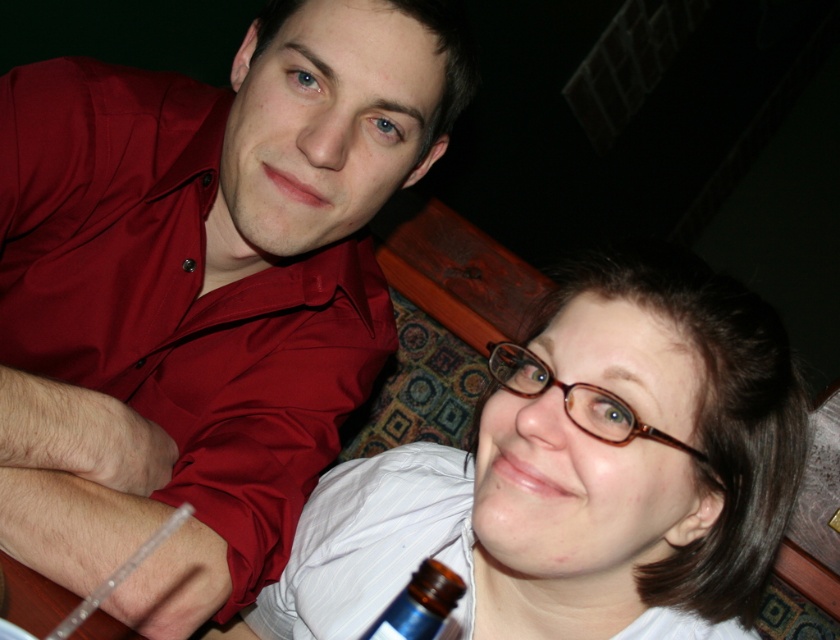
Question: Which point appears farthest from the camera in this image?

Choices:
 (A) (424, 593)
 (B) (723, 403)
 (C) (30, 253)

Answer: (C)

Question: Is matte white shirt at lower center further to the viewer compared to brown glass bottle at lower center?

Choices:
 (A) yes
 (B) no

Answer: (A)

Question: Does matte white shirt at lower center have a greater width compared to brown glass bottle at lower center?

Choices:
 (A) no
 (B) yes

Answer: (B)

Question: Is matte white shirt at lower center smaller than brown glass bottle at lower center?

Choices:
 (A) no
 (B) yes

Answer: (A)

Question: Estimate the real-world distances between objects in this image. Which object is farther from the matte white shirt at lower center?

Choices:
 (A) brown glass bottle at lower center
 (B) shiny red shirt at upper left

Answer: (B)

Question: Based on their relative distances, which object is farther from the brown glass bottle at lower center?

Choices:
 (A) shiny red shirt at upper left
 (B) matte white shirt at lower center

Answer: (A)